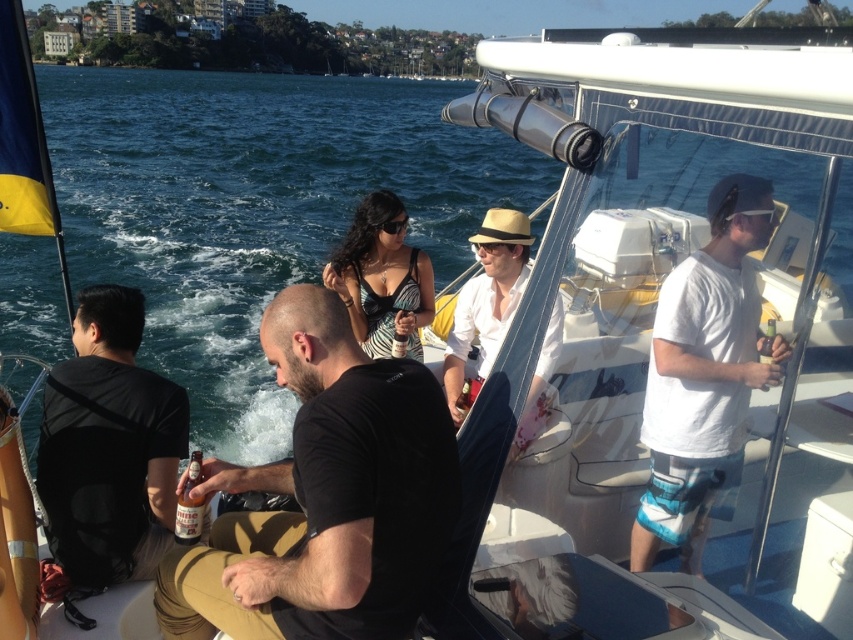
Question: Which point is closer to the camera?

Choices:
 (A) (410, 496)
 (B) (366, 273)

Answer: (A)

Question: Is matte straw hat at center further to the viewer compared to zebra print dress at center?

Choices:
 (A) yes
 (B) no

Answer: (B)

Question: Does clear blue water at center appear on the right side of zebra print dress at center?

Choices:
 (A) no
 (B) yes

Answer: (A)

Question: Which of the following is the closest to the observer?

Choices:
 (A) matte straw hat at center
 (B) black matte shirt at left

Answer: (B)

Question: Can you confirm if black matte shirt at left is positioned to the right of zebra print dress at center?

Choices:
 (A) no
 (B) yes

Answer: (A)

Question: Which of the following is the farthest from the observer?

Choices:
 (A) (302, 164)
 (B) (126, 333)
 (C) (374, 275)

Answer: (A)